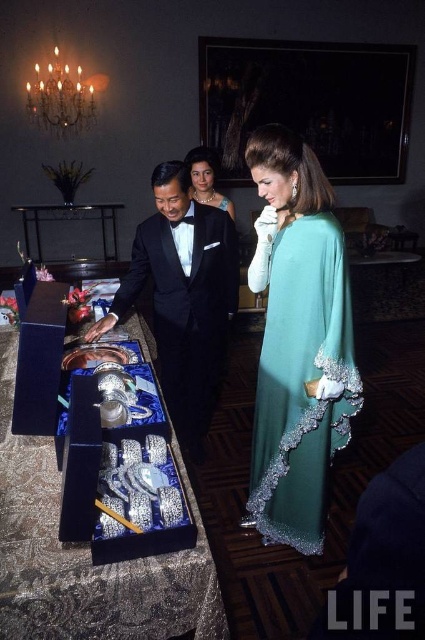
Question: Which object is the closest to the teal satin dress at right?

Choices:
 (A) black satin tuxedo at center
 (B) shiny silver tray at center
 (C) matte black dress at center

Answer: (A)

Question: Where is shiny silver tray at center located in relation to teal satin dress at right in the image?

Choices:
 (A) below
 (B) above

Answer: (A)

Question: Which is nearer to the black satin tuxedo at center?

Choices:
 (A) shiny silver tray at center
 (B) teal satin dress at right
 (C) matte black dress at center

Answer: (C)

Question: Does teal satin dress at right have a smaller size compared to matte black dress at center?

Choices:
 (A) no
 (B) yes

Answer: (B)

Question: Can you confirm if shiny silver tray at center is wider than matte black dress at center?

Choices:
 (A) yes
 (B) no

Answer: (A)

Question: Which point is closer to the camera?

Choices:
 (A) (221, 200)
 (B) (285, 256)

Answer: (B)